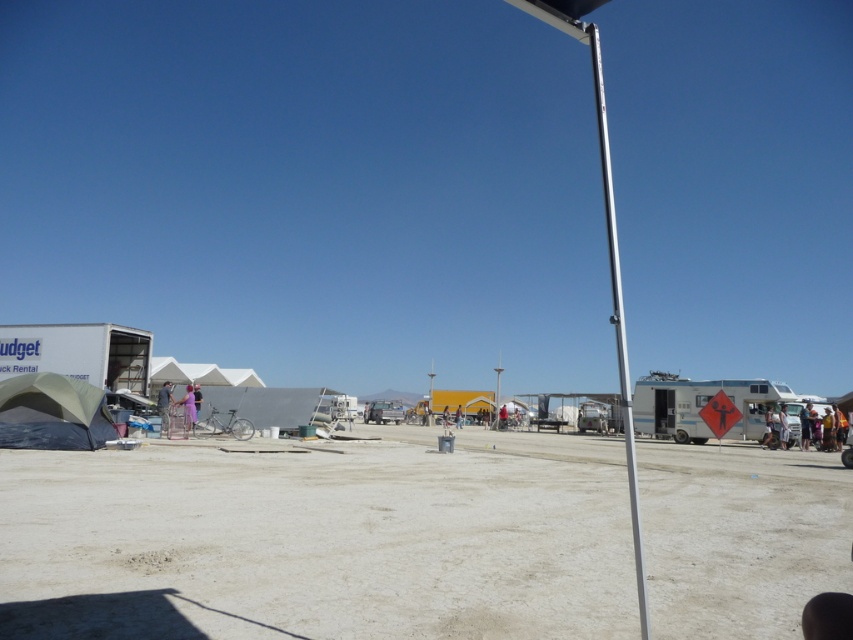
Question: From the image, what is the correct spatial relationship of denim jacket at lower left in relation to light blue fabric at center?

Choices:
 (A) below
 (B) above

Answer: (B)

Question: Does denim jacket at lower left have a smaller size compared to purple fabric dress at center?

Choices:
 (A) no
 (B) yes

Answer: (A)

Question: Which object is farther from the camera taking this photo?

Choices:
 (A) dirt field at center
 (B) purple fabric dress at center
 (C) light blue fabric at center
 (D) denim jacket at lower left

Answer: (C)

Question: Is white matte camper at right wider than denim jacket at lower left?

Choices:
 (A) no
 (B) yes

Answer: (B)

Question: Considering the real-world distances, which object is farthest from the purple fabric dress at center?

Choices:
 (A) light blue fabric at center
 (B) matte gray tent at lower left
 (C) yellow fabric tent at lower right
 (D) white matte camper at right

Answer: (C)

Question: Considering the real-world distances, which object is farthest from the light blue fabric at center?

Choices:
 (A) purple fabric dress at center
 (B) yellow fabric tent at lower right
 (C) silver metallic pole at center
 (D) denim jacket at lower left

Answer: (C)